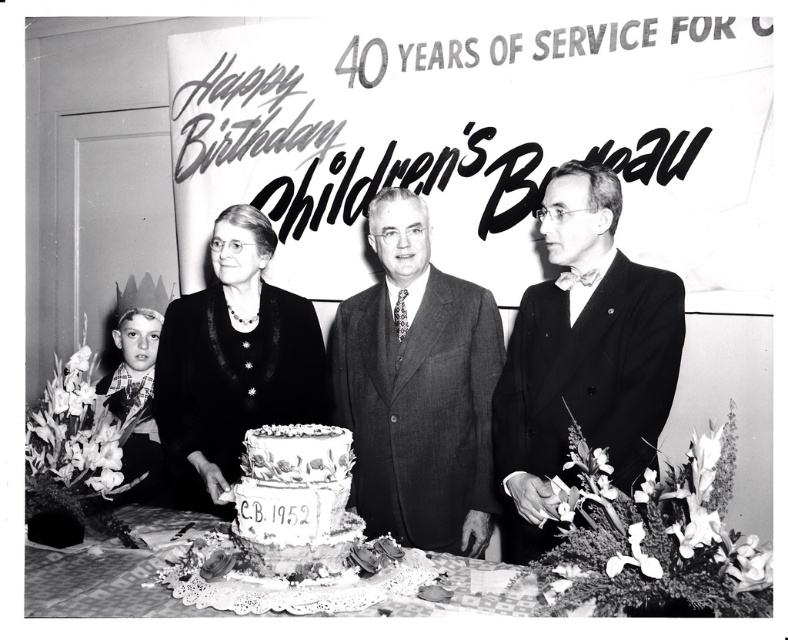
Question: From the image, what is the correct spatial relationship of smooth black suit at right in relation to white frosted cake at center?

Choices:
 (A) left
 (B) right

Answer: (B)

Question: Is smooth black suit at right bigger than white frosted cake at center?

Choices:
 (A) yes
 (B) no

Answer: (A)

Question: Which object is farther from the camera taking this photo?

Choices:
 (A) white lace tablecloth at center
 (B) matte black dress at center

Answer: (B)

Question: Which point is farther from the camera taking this photo?

Choices:
 (A) (547, 401)
 (B) (313, 572)
 (C) (266, 317)
 (D) (448, 582)

Answer: (C)

Question: Is smooth black suit at right to the right of white lace tablecloth at center from the viewer's perspective?

Choices:
 (A) yes
 (B) no

Answer: (A)

Question: Which is nearer to the matte black dress at center?

Choices:
 (A) smooth black suit at right
 (B) white lace tablecloth at center
 (C) smooth black suit at center
 (D) white frosted cake at center

Answer: (C)